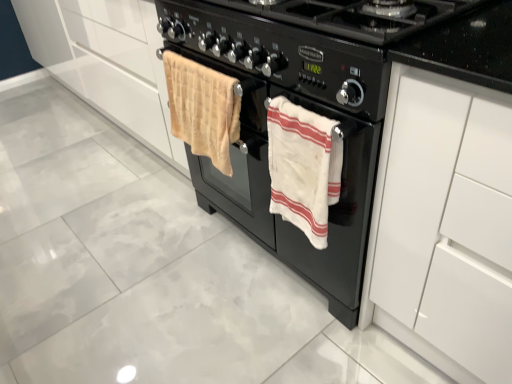
What is the approximate width of white glossy cabinet at right?

white glossy cabinet at right is 23.58 inches wide.

Where is `black matte oven at center`? The image size is (512, 384). black matte oven at center is located at coordinates (270, 193).

Describe the element at coordinates (340, 45) in the screenshot. I see `black matte gas stove at center` at that location.

Image resolution: width=512 pixels, height=384 pixels. I want to click on white glossy cabinet at right, so click(444, 225).

Based on their sizes in the image, would you say black matte gas stove at center is bigger or smaller than white glossy cabinet at right?

In the image, black matte gas stove at center appears to be smaller than white glossy cabinet at right.

Looking at this image, considering the positions of objects black matte gas stove at center and white glossy cabinet at right in the image provided, who is more to the left, black matte gas stove at center or white glossy cabinet at right?

Positioned to the left is black matte gas stove at center.

Which object is more forward, black matte gas stove at center or white glossy cabinet at right?

white glossy cabinet at right.

In the scene shown: Would you say beige plush towel at center, the 2th beach towel viewed from the right, is outside black matte oven at center?

Yes, beige plush towel at center, the 2th beach towel viewed from the right, is not within black matte oven at center.

In the scene shown: Can you confirm if beige plush towel at center, the 2th beach towel viewed from the right, is bigger than black matte oven at center?

No, beige plush towel at center, the 2th beach towel viewed from the right, is not bigger than black matte oven at center.

From a real-world perspective, which object stands above the other?

beige plush towel at center, the 2th beach towel viewed from the right, is physically above.

Does point (183, 76) come behind point (237, 164)?

No.

From the image's perspective, is black matte oven at center positioned above or below white glossy cabinet at right?

Clearly, from the image's perspective, black matte oven at center is above white glossy cabinet at right.

Does black matte oven at center lie behind white glossy cabinet at right?

Yes, it is.

Looking at their sizes, would you say black matte oven at center is wider or thinner than white glossy cabinet at right?

Considering their sizes, black matte oven at center looks slimmer than white glossy cabinet at right.

Looking at this image, which of these two, black matte oven at center or white glossy cabinet at right, is smaller?

white glossy cabinet at right.

Considering the relative positions of white cotton towel at center, acting as the 1th beach towel starting from the right, and white glossy cabinet at right in the image provided, is white cotton towel at center, acting as the 1th beach towel starting from the right, to the left of white glossy cabinet at right from the viewer's perspective?

Indeed, white cotton towel at center, acting as the 1th beach towel starting from the right, is positioned on the left side of white glossy cabinet at right.

From the image's perspective, relative to white glossy cabinet at right, is white cotton towel at center, acting as the 1th beach towel starting from the right, above or below?

From the image's perspective, white cotton towel at center, acting as the 1th beach towel starting from the right, appears above white glossy cabinet at right.

From a real-world perspective, is white cotton towel at center, the second beach towel from the left, located beneath white glossy cabinet at right?

No.

Does white glossy cabinet at right touch black matte gas stove at center?

They are not placed beside each other.

Which is behind, white glossy cabinet at right or black matte gas stove at center?

black matte gas stove at center is further from the camera.

Which object is thinner, white glossy cabinet at right or black matte gas stove at center?

white glossy cabinet at right is thinner.

How far apart are black matte oven at center and black matte gas stove at center?

They are 9.15 inches apart.

Is black matte oven at center outside of black matte gas stove at center?

Yes, black matte oven at center is not within black matte gas stove at center.

Could you tell me if black matte oven at center is turned towards black matte gas stove at center?

No, black matte oven at center is not oriented towards black matte gas stove at center.

Are black matte oven at center and black matte gas stove at center far apart?

black matte oven at center is near black matte gas stove at center, not far away.

Considering the sizes of white cotton towel at center, acting as the 1th beach towel starting from the right, and black matte oven at center in the image, is white cotton towel at center, acting as the 1th beach towel starting from the right, wider or thinner than black matte oven at center?

Considering their sizes, white cotton towel at center, acting as the 1th beach towel starting from the right, looks slimmer than black matte oven at center.

Between white cotton towel at center, the second beach towel from the left, and black matte oven at center, which one appears on the left side from the viewer's perspective?

white cotton towel at center, the second beach towel from the left, is more to the left.

Measure the distance between white cotton towel at center, acting as the 1th beach towel starting from the right, and black matte oven at center.

The distance of white cotton towel at center, acting as the 1th beach towel starting from the right, from black matte oven at center is 5.45 inches.

Based on the photo, is black matte oven at center at the back of white cotton towel at center, acting as the 1th beach towel starting from the right?

Yes.

This screenshot has width=512, height=384. In order to click on gas stove above the white glossy cabinet at right (from the image's perspective) in this screenshot , I will do `click(340, 45)`.

The width and height of the screenshot is (512, 384). Identify the location of oven in front of the beige plush towel at center, acting as the 1th beach towel starting from the left. coord(270,193).

Estimate the real-world distances between objects in this image. Which object is closer to black matte gas stove at center, white cotton towel at center, the second beach towel from the left, or beige plush towel at center, acting as the 1th beach towel starting from the left?

white cotton towel at center, the second beach towel from the left, lies closer to black matte gas stove at center than the other object.

Looking at the image, which one is located closer to beige plush towel at center, acting as the 1th beach towel starting from the left, black matte oven at center or white glossy cabinet at right?

Among the two, black matte oven at center is located nearer to beige plush towel at center, acting as the 1th beach towel starting from the left.

Estimate the real-world distances between objects in this image. Which object is further from white cotton towel at center, the second beach towel from the left, white glossy cabinet at right or black matte gas stove at center?

white glossy cabinet at right lies further to white cotton towel at center, the second beach towel from the left, than the other object.

Consider the image. From the image, which object appears to be nearer to beige plush towel at center, the 2th beach towel viewed from the right, black matte oven at center or white cotton towel at center, acting as the 1th beach towel starting from the right?

black matte oven at center is closer to beige plush towel at center, the 2th beach towel viewed from the right.

From the image, which object appears to be nearer to black matte gas stove at center, black matte oven at center or white glossy cabinet at right?

black matte oven at center.

When comparing their distances from black matte oven at center, does white cotton towel at center, the second beach towel from the left, or white glossy cabinet at right seem further?

white glossy cabinet at right lies further to black matte oven at center than the other object.

Estimate the real-world distances between objects in this image. Which object is further from black matte oven at center, black matte gas stove at center or white glossy cabinet at right?

Based on the image, white glossy cabinet at right appears to be further to black matte oven at center.

From the image, which object appears to be farther from beige plush towel at center, acting as the 1th beach towel starting from the left, black matte gas stove at center or black matte oven at center?

black matte gas stove at center is further to beige plush towel at center, acting as the 1th beach towel starting from the left.

Locate an element on the screen. The width and height of the screenshot is (512, 384). oven between beige plush towel at center, the 2th beach towel viewed from the right, and white glossy cabinet at right, in the horizontal direction is located at coordinates (270, 193).

The width and height of the screenshot is (512, 384). Find the location of `beach towel between beige plush towel at center, acting as the 1th beach towel starting from the left, and white glossy cabinet at right`. beach towel between beige plush towel at center, acting as the 1th beach towel starting from the left, and white glossy cabinet at right is located at coordinates (303, 167).

Find the location of a particular element. gas stove situated between beige plush towel at center, the 2th beach towel viewed from the right, and white glossy cabinet at right from left to right is located at coordinates (340, 45).

At what (x,y) coordinates should I click in order to perform the action: click on gas stove between beige plush towel at center, acting as the 1th beach towel starting from the left, and black matte oven at center from left to right. Please return your answer as a coordinate pair (x, y). The height and width of the screenshot is (384, 512). Looking at the image, I should click on (340, 45).